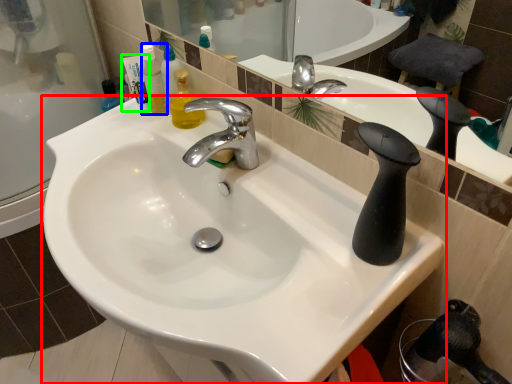
Question: Which object is the farthest from sink (highlighted by a red box)? Choose among these: mouthwash (highlighted by a blue box) or toiletry (highlighted by a green box).

Choices:
 (A) mouthwash
 (B) toiletry

Answer: (B)